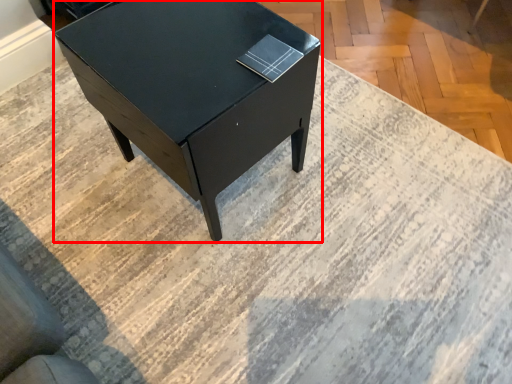
Question: From the image's perspective, what is the correct spatial relationship of table (annotated by the red box) in relation to book?

Choices:
 (A) below
 (B) above

Answer: (A)